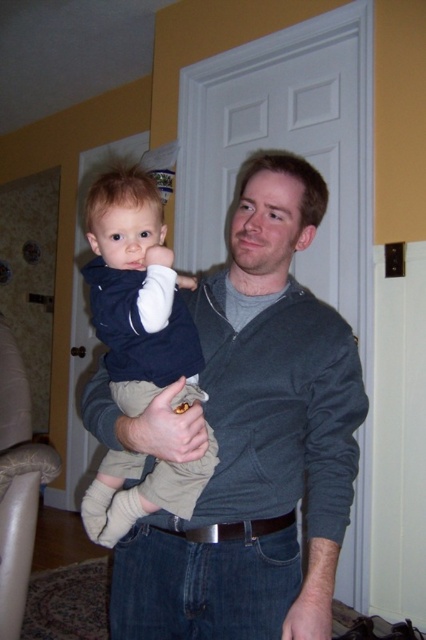
You are a tailor measuring the distance between the matte blue shirt at center and the dark gray corduroy sleeve at center. The minimum required distance for a safety pin is 12 inches. Is the current distance sufficient?

The matte blue shirt at center is 11.46 inches from the dark gray corduroy sleeve at center. Since the required distance is 12 inches, the current distance is insufficient. The safety pin cannot be used here.

You are a delivery robot that is 20 inches wide. You need to move from the entrance to the point marked at coordinates (163, 312) in the image. The path is clear except for a narrow doorway that is 25 inches wide. Will you be able to pass through the doorway while heading towards the point?

The distance of point (163, 312) from the camera is 38.42 inches, but the question is about the doorway width. Since the doorway is 25 inches wide and the robot is 20 inches wide, there is 5 inches of clearance on each side. Therefore, the robot can pass through the doorway while heading towards the point (163, 312).

Based on the photo, you are standing in the room and see two points marked in the image. Which point is closer to you, point [204,384] or point [104,508]?

Point [204,384] is in front of point [104,508], so it is closer to you.